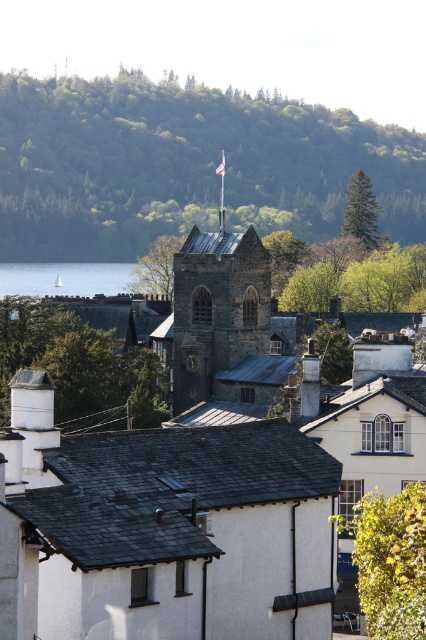
Measure the distance between green leafy hillside at upper center and shiny slate roof at center.

132.57 meters

Can you confirm if green leafy hillside at upper center is taller than shiny slate roof at center?

Correct, green leafy hillside at upper center is much taller as shiny slate roof at center.

Does point (5, 76) lie behind point (207, 243)?

Yes, it is.

Where is `green leafy hillside at upper center`? The image size is (426, 640). green leafy hillside at upper center is located at coordinates (184, 164).

Measure the distance between point (233, 188) and camera.

Point (233, 188) and camera are 283.35 meters apart.

Does green leafy hillside at upper center have a greater height compared to transparent water at lower left?

Correct, green leafy hillside at upper center is much taller as transparent water at lower left.

Who is more distant from viewer, (x=63, y=230) or (x=51, y=276)?

The point (x=51, y=276) is more distant.

The height and width of the screenshot is (640, 426). Find the location of `green leafy hillside at upper center`. green leafy hillside at upper center is located at coordinates (184, 164).

Does transparent water at lower left have a lesser height compared to shiny slate roof at center?

In fact, transparent water at lower left may be taller than shiny slate roof at center.

This screenshot has height=640, width=426. Find the location of `transparent water at lower left`. transparent water at lower left is located at coordinates (65, 278).

Between point (126, 266) and point (204, 241), which one is positioned behind?

The point (126, 266) is behind.

This screenshot has height=640, width=426. Find the location of `transparent water at lower left`. transparent water at lower left is located at coordinates (65, 278).